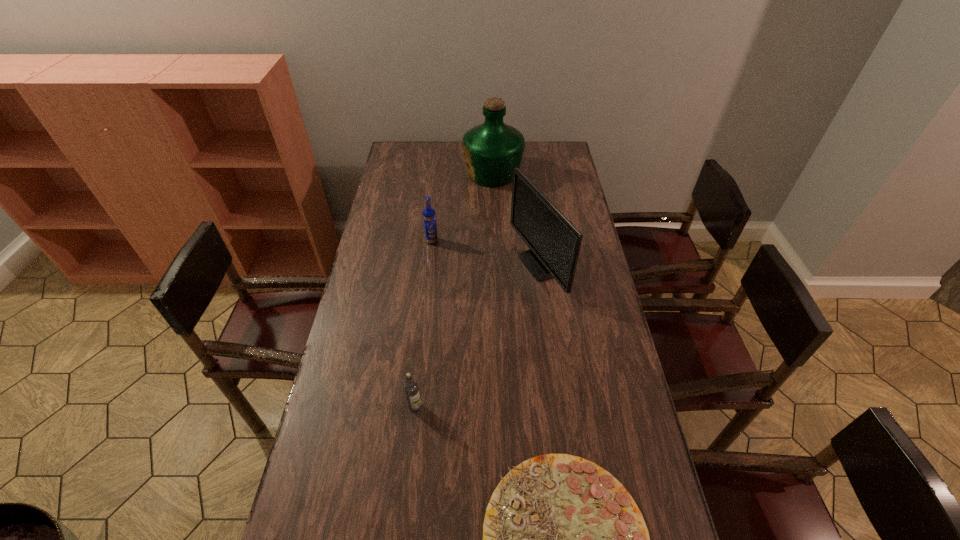
This screenshot has height=540, width=960. Identify the location of free spot between the taller vodka and the nearer vodka. (423, 324).

Where is `free spot between the farthest object and the fourth tallest object`? This screenshot has height=540, width=960. free spot between the farthest object and the fourth tallest object is located at coordinates (454, 291).

Find the location of a particular element. vacant space in between the computer monitor and the shorter vodka is located at coordinates (476, 336).

Identify the location of free spot between the taller vodka and the fourth shortest object. (485, 253).

Locate an element on the screen. This screenshot has height=540, width=960. object that is the closest one to the computer monitor is located at coordinates (429, 216).

Choose which object is the nearest neighbor to the farther vodka. Please provide its 2D coordinates. Your answer should be formatted as a tuple, i.e. [(x, y)], where the tuple contains the x and y coordinates of a point satisfying the conditions above.

[(554, 243)]

In order to click on vacant space that satisfies the following two spatial constraints: 1. on the label side of the farthest object; 2. on the label of the fourth farthest object in this screenshot , I will do [501, 407].

Where is `vacant area that satisfies the following two spatial constraints: 1. on the front-facing side of the computer monitor; 2. on the label of the fourth tallest object`? vacant area that satisfies the following two spatial constraints: 1. on the front-facing side of the computer monitor; 2. on the label of the fourth tallest object is located at coordinates (555, 407).